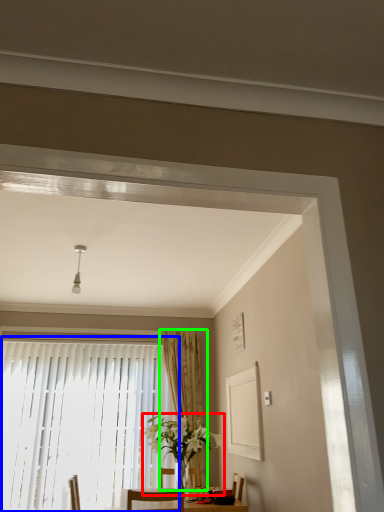
Question: Which object is the closest to the houseplant (highlighted by a red box)? Choose among these: window (highlighted by a blue box) or curtain (highlighted by a green box).

Choices:
 (A) window
 (B) curtain

Answer: (B)